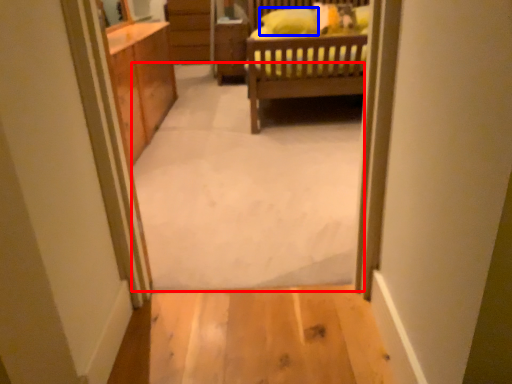
Question: Which of the following is the closest to the observer, plain (highlighted by a red box) or pillow (highlighted by a blue box)?

Choices:
 (A) plain
 (B) pillow

Answer: (A)